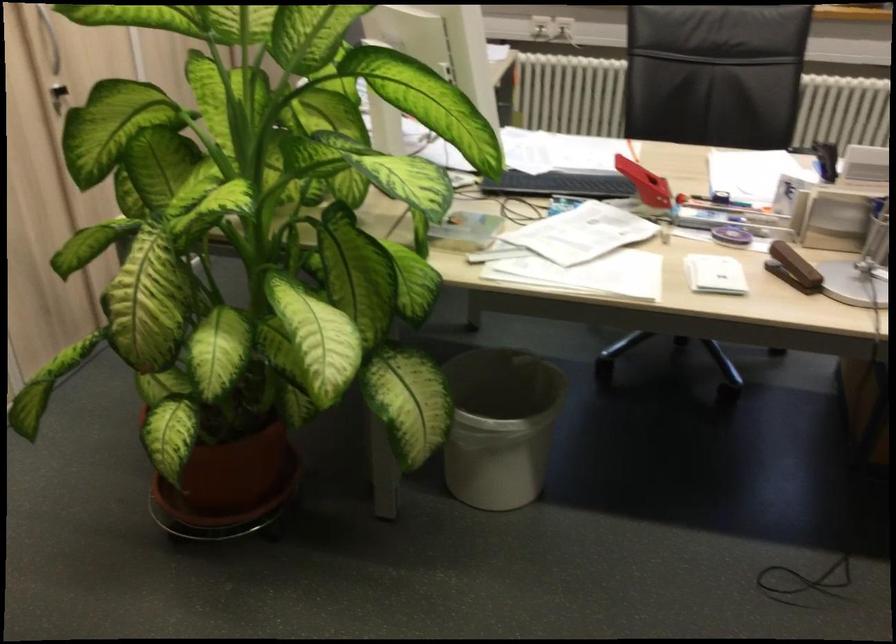
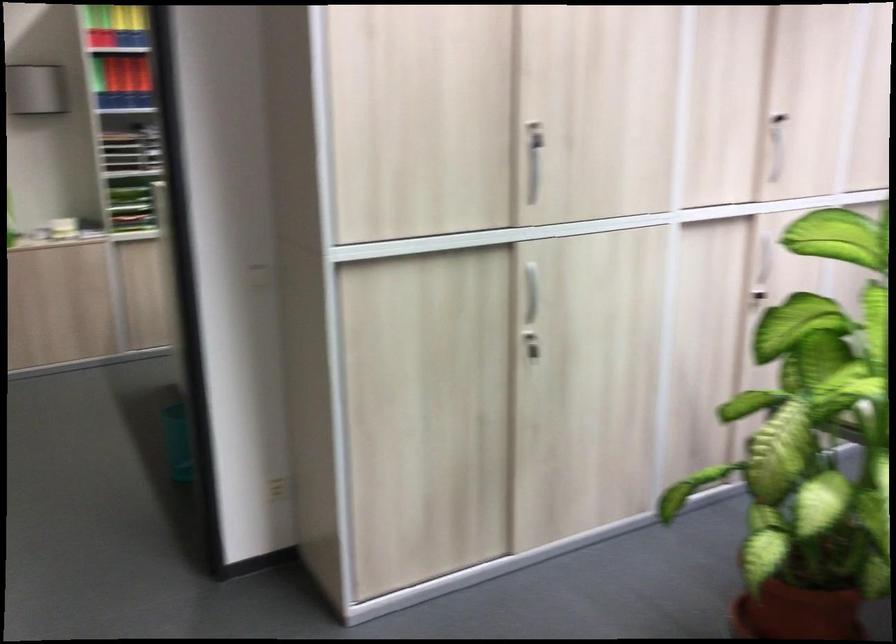
Question: The first image is from the beginning of the video and the second image is from the end. How did the camera likely rotate when shooting the video?

Choices:
 (A) Left
 (B) Right
 (C) Up
 (D) Down

Answer: (A)